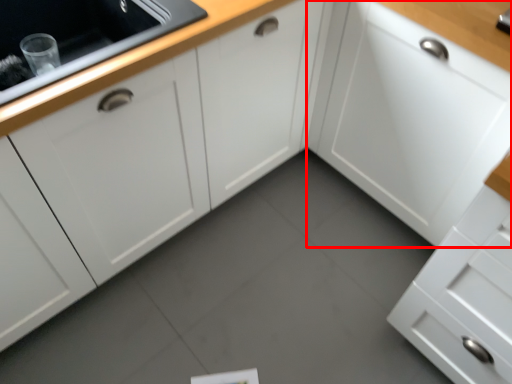
Question: From the image's perspective, what is the correct spatial positioning of cabinetry (annotated by the red box) in reference to cabinetry?

Choices:
 (A) above
 (B) below

Answer: (B)